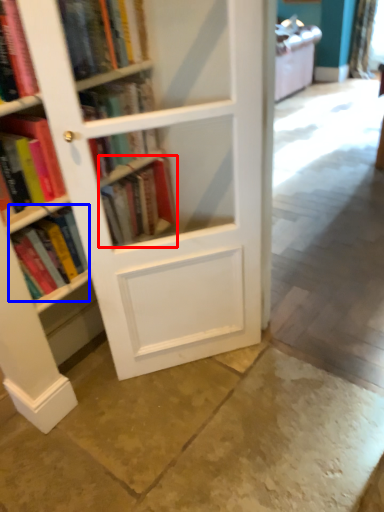
Question: Among these objects, which one is nearest to the camera, book (highlighted by a red box) or book (highlighted by a blue box)?

Choices:
 (A) book
 (B) book

Answer: (B)